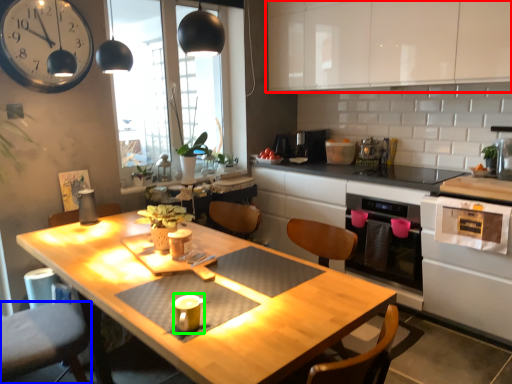
Question: Estimate the real-world distances between objects in this image. Which object is closer to cabinetry (highlighted by a red box), swivel chair (highlighted by a blue box) or appliance (highlighted by a green box)?

Choices:
 (A) swivel chair
 (B) appliance

Answer: (B)